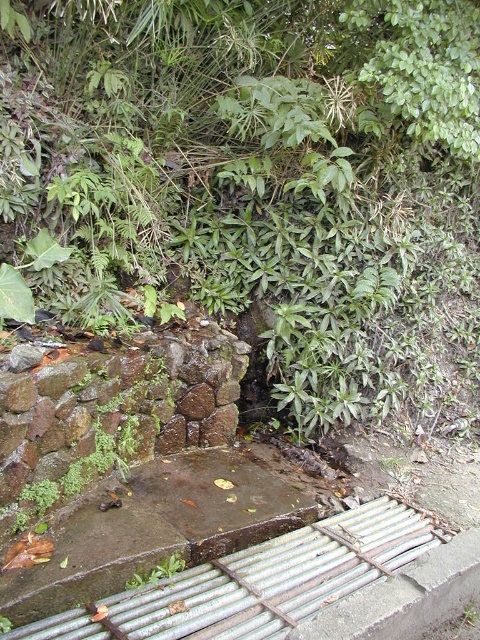
Who is positioned more to the right, green leafy tree at center or green leafy plant at lower left?

From the viewer's perspective, green leafy tree at center appears more on the right side.

Which of these two, green leafy tree at center or green leafy plant at lower left, stands taller?

green leafy tree at center is taller.

What are the coordinates of `green leafy tree at center` in the screenshot? It's located at (261, 179).